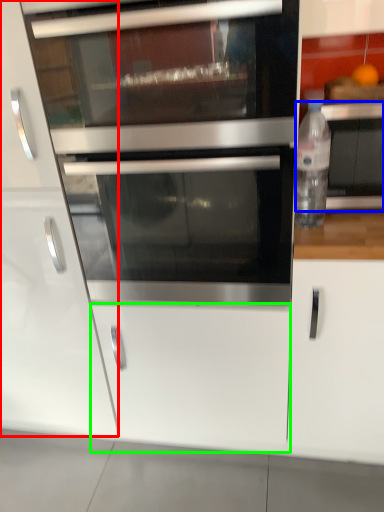
Question: Estimate the real-world distances between objects in this image. Which object is closer to cabinetry (highlighted by a red box), appliance (highlighted by a blue box) or drawer (highlighted by a green box)?

Choices:
 (A) appliance
 (B) drawer

Answer: (B)